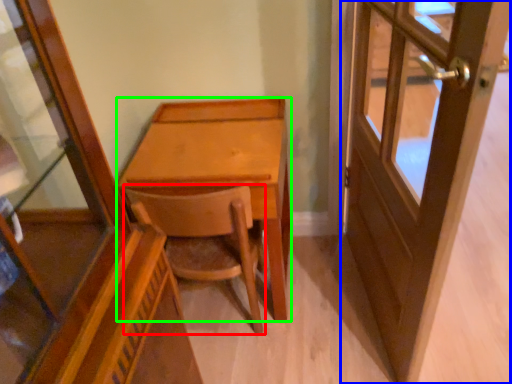
Question: Estimate the real-world distances between objects in this image. Which object is farther from chair (highlighted by a red box), door (highlighted by a blue box) or desk (highlighted by a green box)?

Choices:
 (A) door
 (B) desk

Answer: (A)